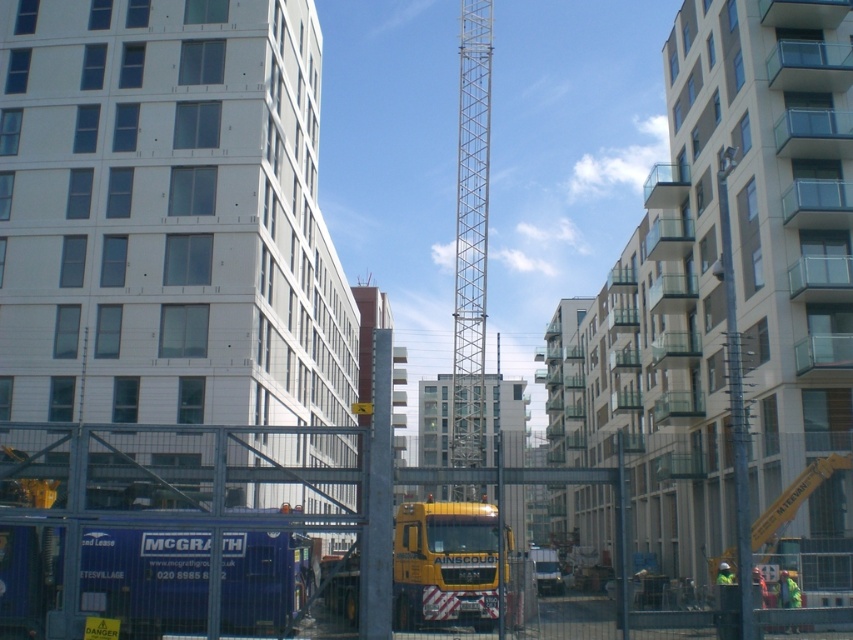
You are a construction worker who needs to move the yellow metallic truck at center to another location. Is it possible to move it without disturbing the metallic silver crane at center?

The metallic silver crane at center is positioned over the yellow metallic truck at center, so moving the truck might disturb the crane. It is not advisable to move the truck without first ensuring the crane is repositioned or secured.

You are a delivery driver approaching the construction site. You need to determine which of the two points, point 1 at coordinates point (x=474, y=12) or point 2 at coordinates point (x=462, y=621), is closer to you. Which point is closer?

Point 1 at coordinates point (x=474, y=12) is closer to you because it is further to the viewer than point 2 at coordinates point (x=462, y=621).

You are a construction worker planning to move the yellow metallic truck at center to a parking area 10 meters away. Considering the space between the metallic silver crane at center and the truck, can the truck be moved without any obstruction?

The metallic silver crane at center is wider than the yellow metallic truck at center. Since the crane is wider, there should be enough space to maneuver the truck around it to the parking area 10 meters away without obstruction.